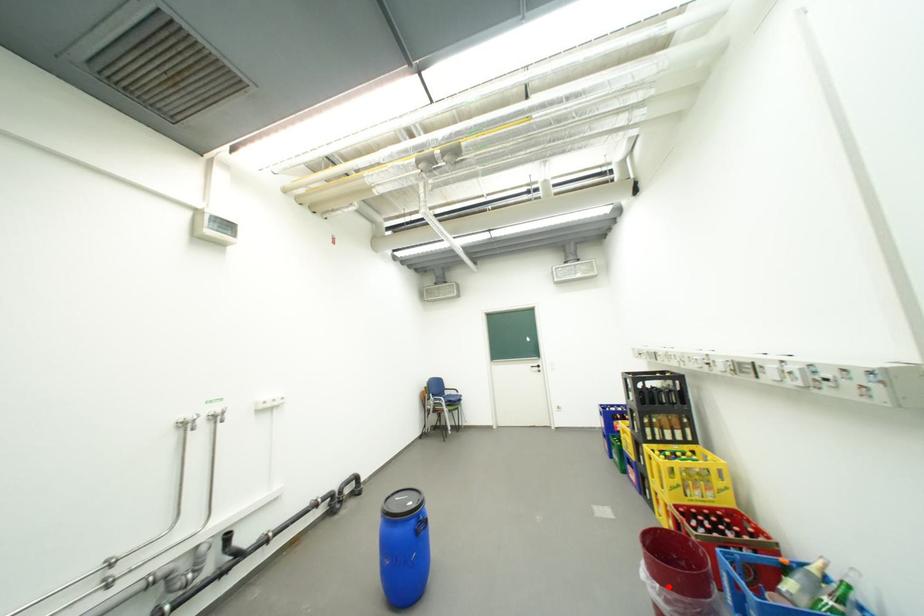
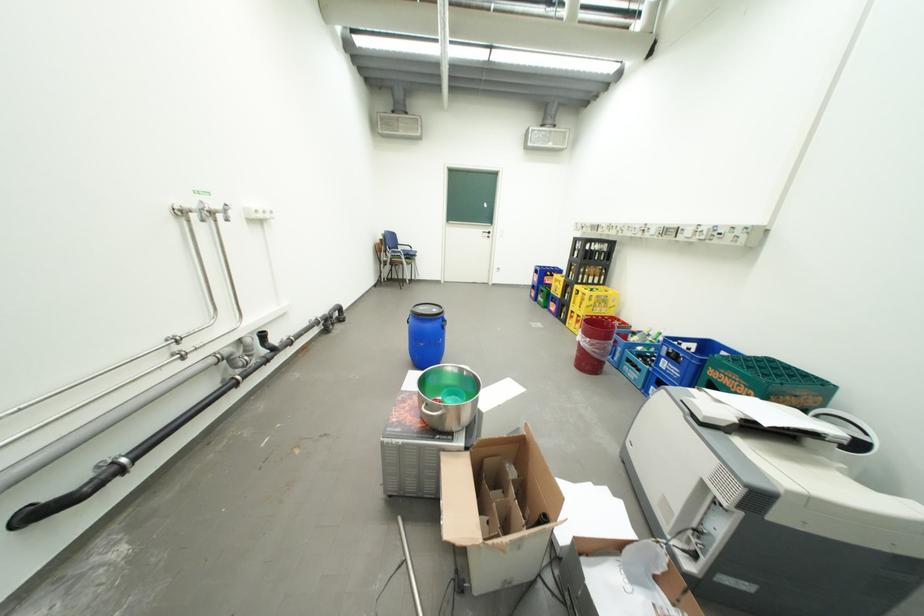
The point at the highlighted location is marked in the first image. Where is the corresponding point in the second image?

(599, 341)